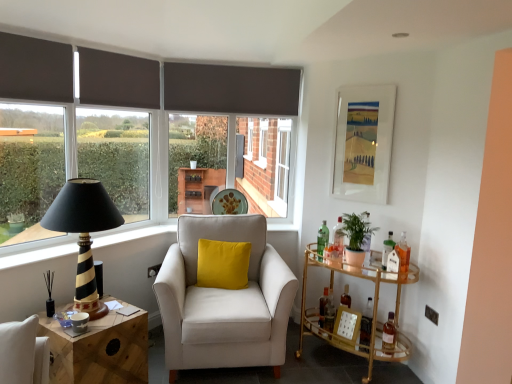
The image size is (512, 384). What do you see at coordinates (84, 233) in the screenshot?
I see `black painted wood lighthouse at left` at bounding box center [84, 233].

The height and width of the screenshot is (384, 512). What do you see at coordinates (282, 168) in the screenshot?
I see `clear glass door at center` at bounding box center [282, 168].

Locate an element on the screen. This screenshot has height=384, width=512. black fabric window screen at left is located at coordinates (29, 169).

Measure the distance between point (360, 266) and camera.

Point (360, 266) and camera are 2.76 meters apart.

Identify the location of green leafy plant at right. (356, 237).

Find the location of a particular element. wooden side table at lower left, which is counted as the second table, starting from the right is located at coordinates (99, 350).

From a real-world perspective, between white fabric armchair at center and metallic silver power outlet at lower right, who is vertically lower?

metallic silver power outlet at lower right.

In terms of size, does white fabric armchair at center appear bigger or smaller than metallic silver power outlet at lower right?

white fabric armchair at center is bigger than metallic silver power outlet at lower right.

Between white fabric armchair at center and metallic silver power outlet at lower right, which one has larger width?

white fabric armchair at center is wider.

Which object is more forward, white fabric armchair at center or metallic silver power outlet at lower right?

Positioned in front is white fabric armchair at center.

Considering the sizes of objects wooden side table at lower left, which is counted as the second table, starting from the right, and dark grey fabric curtain at upper center, which appears as the first curtain when viewed from the back, in the image provided, who is wider, wooden side table at lower left, which is counted as the second table, starting from the right, or dark grey fabric curtain at upper center, which appears as the first curtain when viewed from the back,?

Wider between the two is wooden side table at lower left, which is counted as the second table, starting from the right.

From the image's perspective, between wooden side table at lower left, which is the first table from left to right, and dark grey fabric curtain at upper center, the 1th curtain in the right-to-left sequence, who is located below?

wooden side table at lower left, which is the first table from left to right, appears lower in the image.

Is wooden side table at lower left, which is counted as the second table, starting from the right, beside dark grey fabric curtain at upper center, the 1th curtain in the right-to-left sequence?

No, wooden side table at lower left, which is counted as the second table, starting from the right, is not touching dark grey fabric curtain at upper center, the 1th curtain in the right-to-left sequence.

From the image's perspective, would you say black fabric window screen at left is positioned over green leafy plant at right?

Correct, black fabric window screen at left appears higher than green leafy plant at right in the image.

Is black fabric window screen at left situated inside green leafy plant at right or outside?

black fabric window screen at left cannot be found inside green leafy plant at right.

Which object is closer to the camera taking this photo, black fabric window screen at left or green leafy plant at right?

black fabric window screen at left is in front.

How far apart are black fabric window screen at left and green leafy plant at right?

7.38 feet.

From a real-world perspective, is white matte picture frame at upper right, which is the first picture frame in top-to-bottom order, on top of dark grey fabric curtain at upper left, the 1th curtain viewed from the front?

No, from a real-world perspective, white matte picture frame at upper right, which is the first picture frame in top-to-bottom order, is not above dark grey fabric curtain at upper left, the 1th curtain viewed from the front.

Is white matte picture frame at upper right, marked as the 2th picture frame in a bottom-to-top arrangement, taller or shorter than dark grey fabric curtain at upper left, the second curtain viewed from the back?

In the image, white matte picture frame at upper right, marked as the 2th picture frame in a bottom-to-top arrangement, appears to be taller than dark grey fabric curtain at upper left, the second curtain viewed from the back.

Is the depth of white matte picture frame at upper right, marked as the 2th picture frame in a bottom-to-top arrangement, greater than that of dark grey fabric curtain at upper left, which ranks as the 2th curtain in right-to-left order?

Yes.

Between point (387, 133) and point (45, 55), which one is positioned behind?

Point (387, 133)

Is wooden side table at lower left, which is counted as the second table, starting from the right, further to the viewer compared to white matte picture frame at upper right, which is the first picture frame in top-to-bottom order?

No, it is not.

Is wooden side table at lower left, which is counted as the second table, starting from the right, smaller than white matte picture frame at upper right, which is the first picture frame in top-to-bottom order?

No, wooden side table at lower left, which is counted as the second table, starting from the right, is not smaller than white matte picture frame at upper right, which is the first picture frame in top-to-bottom order.

Does wooden side table at lower left, which is the first table from left to right, have a greater width compared to white matte picture frame at upper right, which is the first picture frame in top-to-bottom order?

Correct, the width of wooden side table at lower left, which is the first table from left to right, exceeds that of white matte picture frame at upper right, which is the first picture frame in top-to-bottom order.

Considering the sizes of wooden side table at lower left, which is counted as the second table, starting from the right, and white matte picture frame at upper right, marked as the 2th picture frame in a bottom-to-top arrangement, in the image, is wooden side table at lower left, which is counted as the second table, starting from the right, taller or shorter than white matte picture frame at upper right, marked as the 2th picture frame in a bottom-to-top arrangement,?

In the image, wooden side table at lower left, which is counted as the second table, starting from the right, appears to be shorter than white matte picture frame at upper right, marked as the 2th picture frame in a bottom-to-top arrangement.

Between velvet yellow pillow at center and metallic gold picture frame at lower right, placed as the 2th picture frame when sorted from top to bottom, which one appears on the left side from the viewer's perspective?

velvet yellow pillow at center is more to the left.

Which object is closer to the camera, velvet yellow pillow at center or metallic gold picture frame at lower right, which appears as the first picture frame when ordered from the bottom?

metallic gold picture frame at lower right, which appears as the first picture frame when ordered from the bottom, is closer to the camera.

Looking at their sizes, would you say velvet yellow pillow at center is wider or thinner than metallic gold picture frame at lower right, placed as the 2th picture frame when sorted from top to bottom?

Considering their sizes, velvet yellow pillow at center looks broader than metallic gold picture frame at lower right, placed as the 2th picture frame when sorted from top to bottom.

Does dark grey fabric curtain at upper center, which ranks as the 2th curtain in left-to-right order, appear on the left side of metallic gold picture frame at lower right, which appears as the first picture frame when ordered from the bottom?

Yes.

Considering the sizes of dark grey fabric curtain at upper center, the 1th curtain in the right-to-left sequence, and metallic gold picture frame at lower right, placed as the 2th picture frame when sorted from top to bottom, in the image, is dark grey fabric curtain at upper center, the 1th curtain in the right-to-left sequence, bigger or smaller than metallic gold picture frame at lower right, placed as the 2th picture frame when sorted from top to bottom,?

In the image, dark grey fabric curtain at upper center, the 1th curtain in the right-to-left sequence, appears to be larger than metallic gold picture frame at lower right, placed as the 2th picture frame when sorted from top to bottom.

From their relative heights in the image, would you say dark grey fabric curtain at upper center, which ranks as the 2th curtain in left-to-right order, is taller or shorter than metallic gold picture frame at lower right, placed as the 2th picture frame when sorted from top to bottom?

dark grey fabric curtain at upper center, which ranks as the 2th curtain in left-to-right order, is taller than metallic gold picture frame at lower right, placed as the 2th picture frame when sorted from top to bottom.

This screenshot has height=384, width=512. Identify the location of power outlet behind the white fabric armchair at center. (431, 315).

Where is `table that is the 2nd one when counting forward from the dark grey fabric curtain at upper center, which appears as the first curtain when viewed from the back`? This screenshot has width=512, height=384. table that is the 2nd one when counting forward from the dark grey fabric curtain at upper center, which appears as the first curtain when viewed from the back is located at coordinates (99, 350).

Estimate the real-world distances between objects in this image. Which object is closer to dark grey fabric curtain at upper center, which appears as the first curtain when viewed from the back, dark grey fabric curtain at upper left, which is the 1th curtain in left-to-right order, or velvet yellow pillow at center?

dark grey fabric curtain at upper left, which is the 1th curtain in left-to-right order, lies closer to dark grey fabric curtain at upper center, which appears as the first curtain when viewed from the back, than the other object.

Which object lies nearer to the anchor point dark grey fabric curtain at upper center, which appears as the first curtain when viewed from the back, metallic gold picture frame at lower right, which appears as the first picture frame when ordered from the bottom, or dark grey fabric curtain at upper left, the second curtain viewed from the back?

dark grey fabric curtain at upper left, the second curtain viewed from the back, lies closer to dark grey fabric curtain at upper center, which appears as the first curtain when viewed from the back, than the other object.

Based on their spatial positions, is wooden side table at lower left, which is the first table from left to right, or white matte picture frame at upper right, marked as the 2th picture frame in a bottom-to-top arrangement, further from velvet yellow pillow at center?

Among the two, white matte picture frame at upper right, marked as the 2th picture frame in a bottom-to-top arrangement, is located further to velvet yellow pillow at center.

Considering their positions, is matte brown curtain at left positioned closer to velvet yellow pillow at center than metallic silver power outlet at lower right?

The object closer to velvet yellow pillow at center is matte brown curtain at left.

Based on their spatial positions, is velvet yellow pillow at center or white fabric armchair at center closer to black painted wood lighthouse at left?

white fabric armchair at center is positioned closer to the anchor black painted wood lighthouse at left.

Which object lies further to the anchor point velvet yellow pillow at center, gold glass bar cart at right, the 1th table when ordered from right to left, or white fabric armchair at center?

gold glass bar cart at right, the 1th table when ordered from right to left, is further to velvet yellow pillow at center.

Estimate the real-world distances between objects in this image. Which object is further from black fabric window screen at left, dark grey fabric curtain at upper center, marked as the 2th curtain in a front-to-back arrangement, or white fabric armchair at center?

white fabric armchair at center is further to black fabric window screen at left.

Which object lies further to the anchor point clear glass door at center, dark grey fabric curtain at upper left, which ranks as the 2th curtain in right-to-left order, or velvet yellow pillow at center?

dark grey fabric curtain at upper left, which ranks as the 2th curtain in right-to-left order, lies further to clear glass door at center than the other object.

I want to click on pillow between black fabric window screen at left and metallic silver power outlet at lower right in the horizontal direction, so click(x=223, y=264).

Where is `table between black painted wood lighthouse at left and white matte picture frame at upper right, which is the first picture frame in top-to-bottom order, in the horizontal direction`? This screenshot has height=384, width=512. table between black painted wood lighthouse at left and white matte picture frame at upper right, which is the first picture frame in top-to-bottom order, in the horizontal direction is located at coordinates pos(370,316).

At what (x,y) coordinates should I click in order to perform the action: click on lamp located between black fabric window screen at left and white fabric armchair at center in the left-right direction. Please return your answer as a coordinate pair (x, y). Image resolution: width=512 pixels, height=384 pixels. Looking at the image, I should click on (84, 233).

Find the location of a particular element. The image size is (512, 384). window between black fabric window screen at left and green leafy plant at right from left to right is located at coordinates (116, 157).